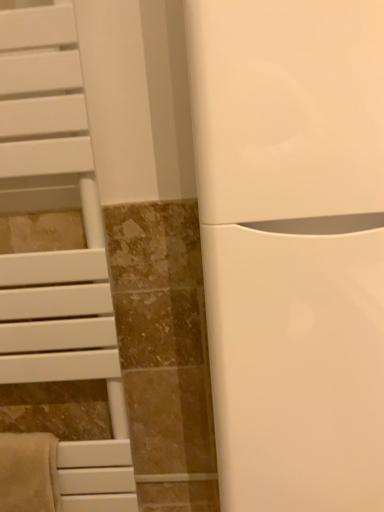
Question: Is beige soft towel at lower left thinner than white glossy toilet at center?

Choices:
 (A) no
 (B) yes

Answer: (B)

Question: From a real-world perspective, is beige soft towel at lower left on white glossy toilet at center?

Choices:
 (A) no
 (B) yes

Answer: (A)

Question: Can you confirm if beige soft towel at lower left is wider than white glossy toilet at center?

Choices:
 (A) no
 (B) yes

Answer: (A)

Question: From the image's perspective, would you say beige soft towel at lower left is shown under white glossy toilet at center?

Choices:
 (A) no
 (B) yes

Answer: (B)

Question: Is beige soft towel at lower left aimed at white glossy toilet at center?

Choices:
 (A) no
 (B) yes

Answer: (A)

Question: From a real-world perspective, is beige soft towel at lower left below white glossy toilet at center?

Choices:
 (A) no
 (B) yes

Answer: (B)

Question: From the image's perspective, is white matte towel rack at left on top of white glossy toilet at center?

Choices:
 (A) yes
 (B) no

Answer: (B)

Question: From a real-world perspective, is white matte towel rack at left located beneath white glossy toilet at center?

Choices:
 (A) no
 (B) yes

Answer: (B)

Question: Can you confirm if white matte towel rack at left is positioned to the left of white glossy toilet at center?

Choices:
 (A) yes
 (B) no

Answer: (A)

Question: Is white matte towel rack at left positioned in front of white glossy toilet at center?

Choices:
 (A) no
 (B) yes

Answer: (A)

Question: Is white matte towel rack at left at the right side of white glossy toilet at center?

Choices:
 (A) yes
 (B) no

Answer: (B)

Question: Does white matte towel rack at left have a lesser height compared to white glossy toilet at center?

Choices:
 (A) yes
 (B) no

Answer: (B)

Question: Does white glossy toilet at center have a larger size compared to white matte towel rack at left?

Choices:
 (A) yes
 (B) no

Answer: (A)